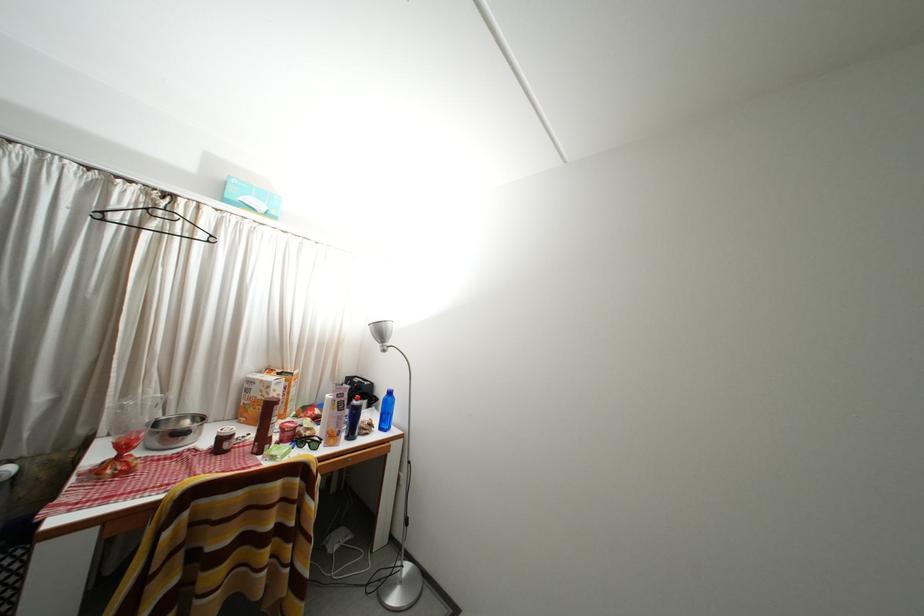
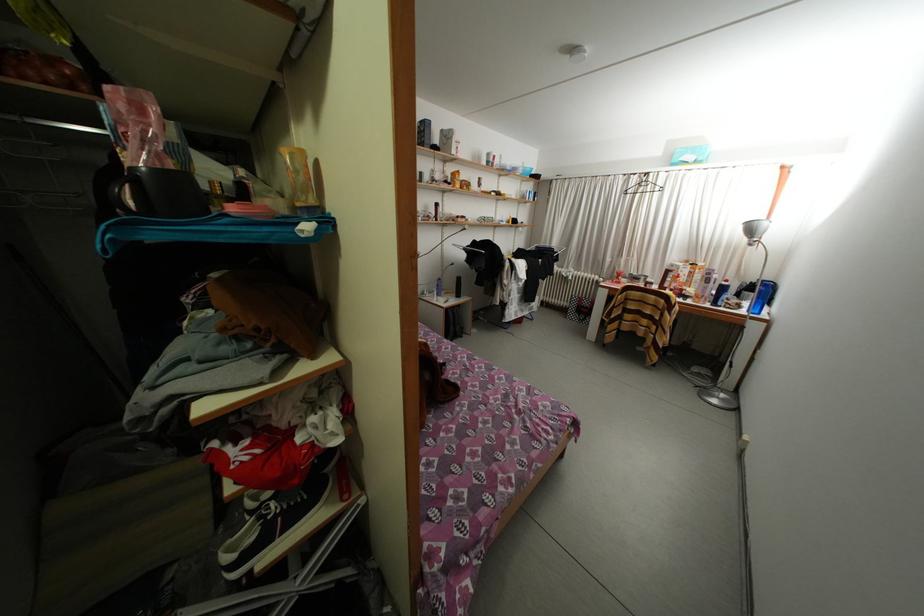
Find the pixel in the second image that matches [379,431] in the first image.

(747, 310)